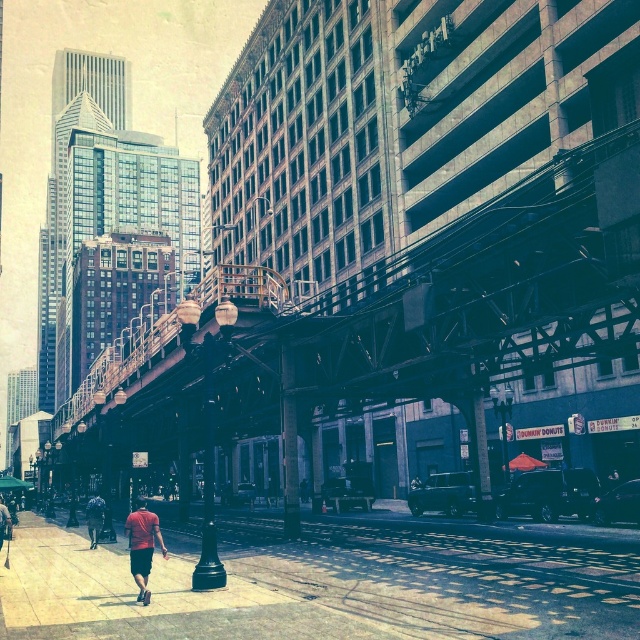
Question: Which of the following is the farthest from the observer?

Choices:
 (A) (99, 522)
 (B) (540, 566)
 (C) (1, 500)
 (D) (154, 532)

Answer: (C)

Question: Based on their relative distances, which object is nearer to the dark blue jeans at center?

Choices:
 (A) red shirt at lower left
 (B) red cotton t-shirt at center

Answer: (A)

Question: Which object is positioned closest to the black glossy streetlight at center?

Choices:
 (A) red shirt at lower left
 (B) dark blue jeans at center

Answer: (B)

Question: Is smooth concrete sidewalk at center below black glossy streetlight at center?

Choices:
 (A) yes
 (B) no

Answer: (A)

Question: From the image, what is the correct spatial relationship of smooth concrete sidewalk at center in relation to black glossy streetlight at center?

Choices:
 (A) right
 (B) left

Answer: (A)

Question: Is smooth concrete sidewalk at center bigger than red shirt at lower left?

Choices:
 (A) no
 (B) yes

Answer: (A)